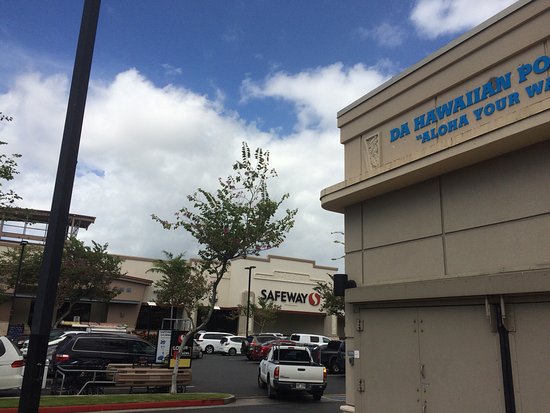
Where is `door`? door is located at coordinates 451,369, 373,374.